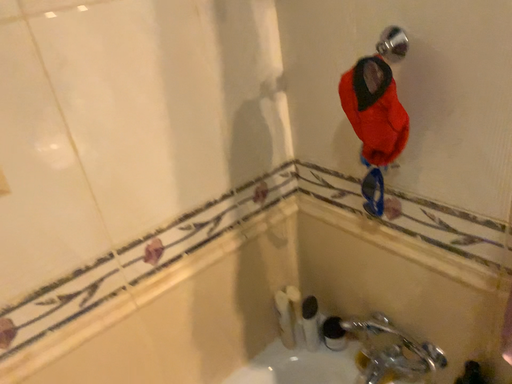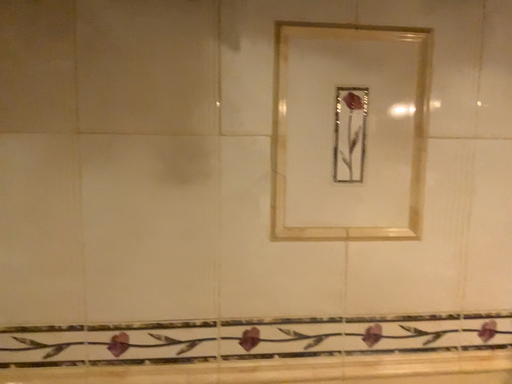
Question: How did the camera likely rotate when shooting the video?

Choices:
 (A) rotated left
 (B) rotated right

Answer: (A)